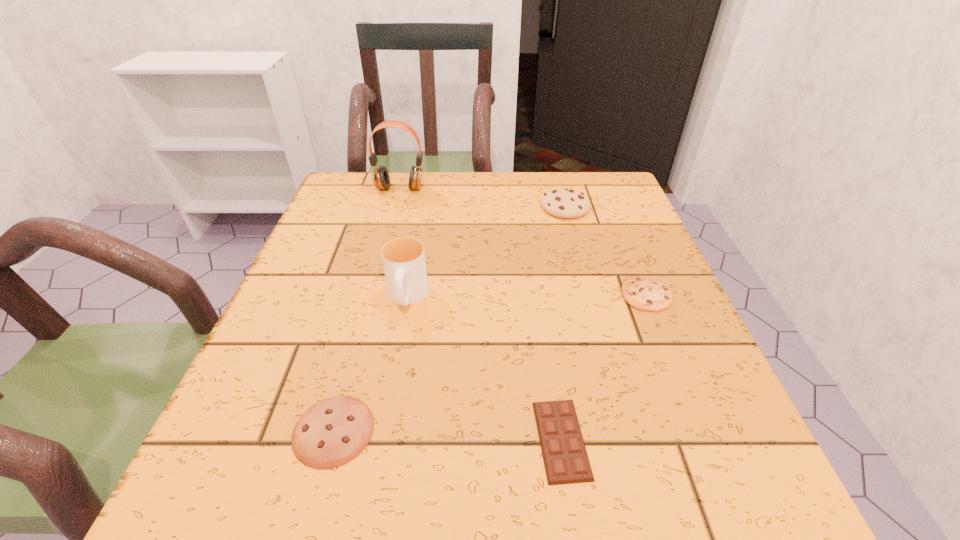
The height and width of the screenshot is (540, 960). Identify the location of vacant region located 0.290m with the handle on the side of the cup. tap(373, 487).

Identify the location of free space located 0.120m on the left of the farthest cookie. This screenshot has height=540, width=960. (492, 207).

Where is `vacant space located on the front of the second nearest cookie`? The width and height of the screenshot is (960, 540). vacant space located on the front of the second nearest cookie is located at coordinates (693, 409).

Find the location of a particular element. vacant space situated 0.180m on the back of the nearest cookie is located at coordinates (366, 311).

What are the coordinates of `free spot located 0.370m on the left of the chocolate bar` in the screenshot? It's located at (270, 440).

Where is `headset that is at the far edge`? This screenshot has height=540, width=960. headset that is at the far edge is located at coordinates (380, 175).

This screenshot has width=960, height=540. Find the location of `cookie that is at the far edge`. cookie that is at the far edge is located at coordinates (564, 203).

This screenshot has width=960, height=540. I want to click on cookie located in the near edge section of the desktop, so click(332, 432).

The height and width of the screenshot is (540, 960). Find the location of `chocolate bar positioned at the near edge`. chocolate bar positioned at the near edge is located at coordinates (565, 458).

I want to click on headset situated at the left edge, so point(380,175).